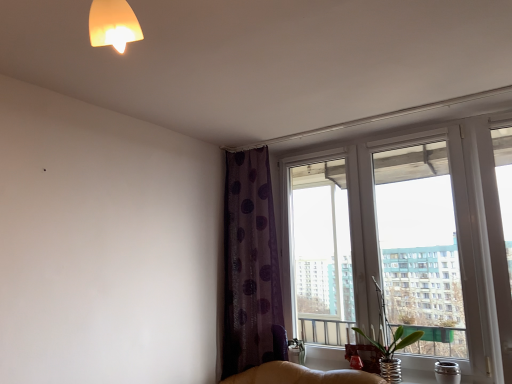
Question: Considering the positions of transparent glass window at upper right and green glass vase at window in the image, is transparent glass window at upper right wider or thinner than green glass vase at window?

Choices:
 (A) wide
 (B) thin

Answer: (B)

Question: From a real-world perspective, relative to green glass vase at window, is transparent glass window at upper right vertically above or below?

Choices:
 (A) below
 (B) above

Answer: (B)

Question: Which of these objects is positioned farthest from the transparent glass window at upper right?

Choices:
 (A) purple dotted fabric at upper center
 (B) green glass vase at window

Answer: (B)

Question: Estimate the real-world distances between objects in this image. Which object is closer to the purple dotted fabric at upper center?

Choices:
 (A) green glass vase at window
 (B) transparent glass window at upper right

Answer: (B)